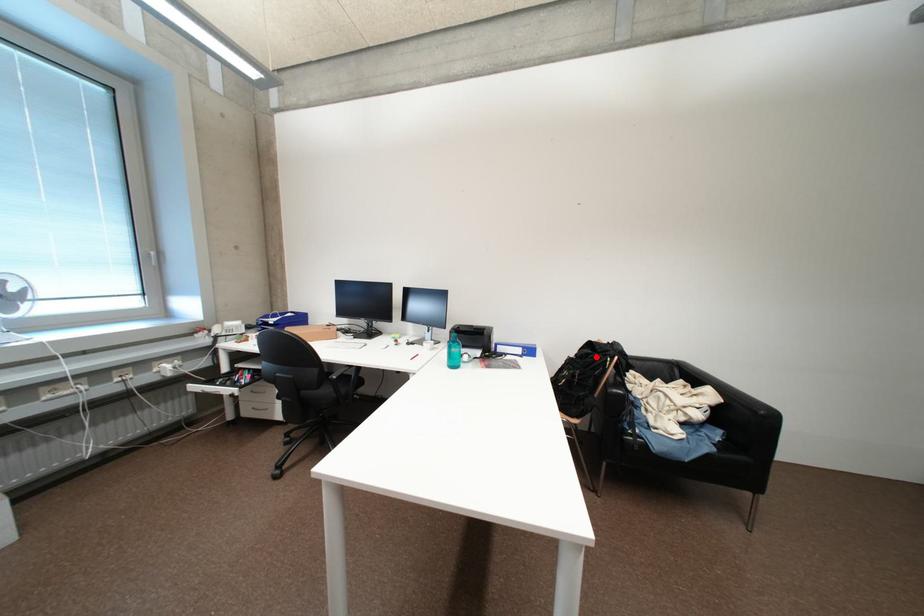
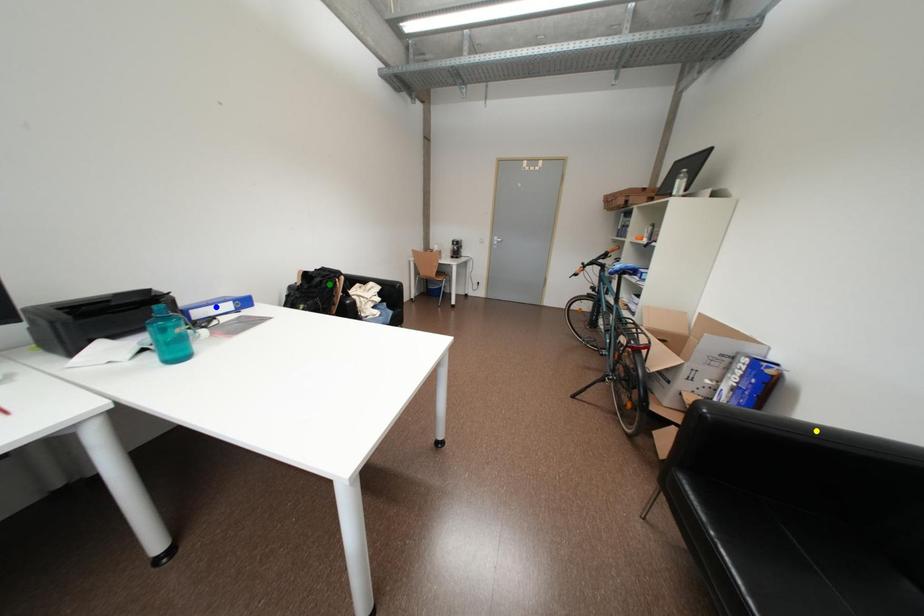
Question: I am providing you with two images of the same scene from different viewpoints. A red point is marked on the first image. You are given multiple points on the second image. Which point in image 2 represents the same 3d spot as the red point in image 1?

Choices:
 (A) green point
 (B) blue point
 (C) yellow point

Answer: (A)